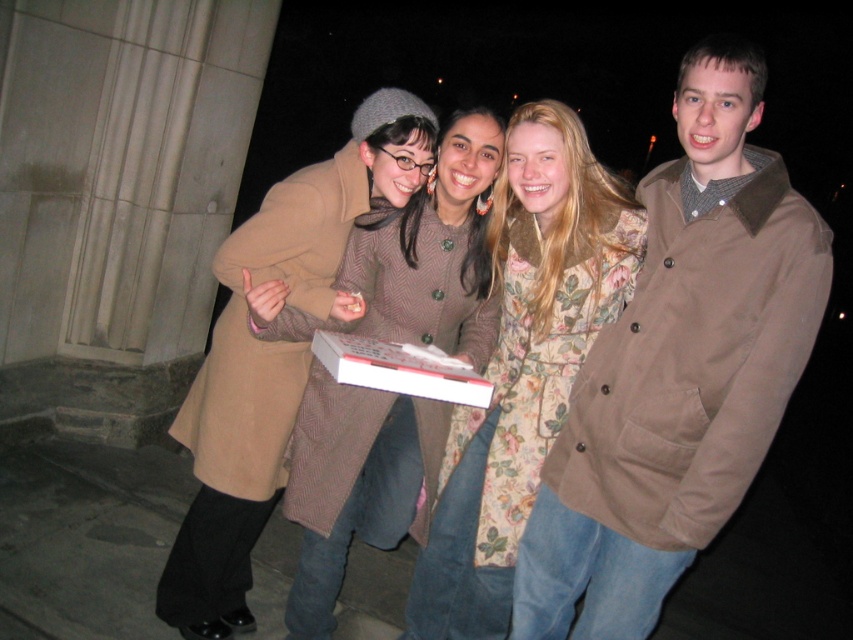
Between point (485, 486) and point (314, 497), which one is positioned behind?

Point (485, 486)

Describe the element at coordinates (524, 364) in the screenshot. The image size is (853, 640). I see `floral-patterned coat at center` at that location.

Find the location of a particular element. The height and width of the screenshot is (640, 853). floral-patterned coat at center is located at coordinates (524, 364).

Who is lower down, brown cotton jacket at right or floral-patterned coat at center?

floral-patterned coat at center is below.

Is point (625, 404) positioned in front of point (506, 420)?

Yes, point (625, 404) is in front of point (506, 420).

Between point (641, 500) and point (622, 259), which one is positioned behind?

Point (622, 259)

Where is `brown cotton jacket at right`? This screenshot has height=640, width=853. brown cotton jacket at right is located at coordinates (677, 369).

Does brown cotton jacket at right appear under brown wool coat at center?

Yes.

Which of these two, brown cotton jacket at right or brown wool coat at center, stands shorter?

brown wool coat at center

Measure the distance between point (x=616, y=403) and camera.

The distance of point (x=616, y=403) from camera is 7.84 feet.

Locate an element on the screen. brown cotton jacket at right is located at coordinates (677, 369).